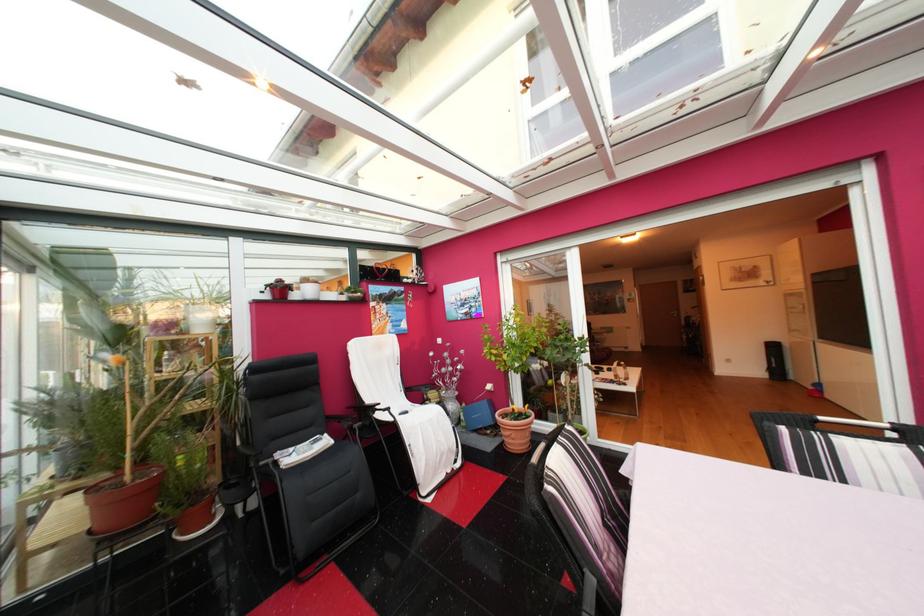
Identify the location of white chair armrest. (367, 411).